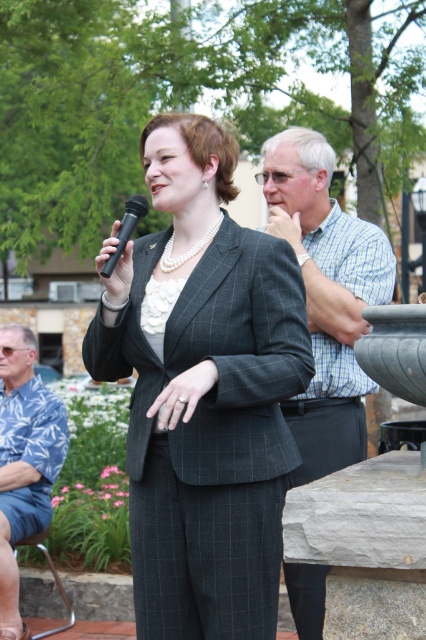
Question: Is matte gray suit at center below blue floral shirt at left?

Choices:
 (A) no
 (B) yes

Answer: (A)

Question: Does matte gray suit at center have a smaller size compared to blue floral shirt at left?

Choices:
 (A) no
 (B) yes

Answer: (B)

Question: Can you confirm if checkered shirt at center is positioned below blue floral shirt at left?

Choices:
 (A) no
 (B) yes

Answer: (A)

Question: Among these points, which one is farthest from the camera?

Choices:
 (A) [x=143, y=598]
 (B) [x=319, y=369]
 (C) [x=17, y=596]
 (D) [x=134, y=198]

Answer: (C)

Question: Which of these objects is positioned closest to the checkered shirt at center?

Choices:
 (A) matte gray suit at center
 (B) blue floral shirt at left
 (C) black plastic microphone at upper center

Answer: (A)

Question: Among these objects, which one is nearest to the camera?

Choices:
 (A) checkered shirt at center
 (B) black plastic microphone at upper center

Answer: (B)